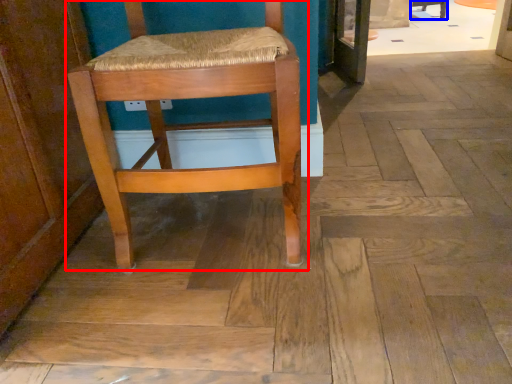
Question: Which object is closer to the camera taking this photo, chair (highlighted by a red box) or chair (highlighted by a blue box)?

Choices:
 (A) chair
 (B) chair

Answer: (A)